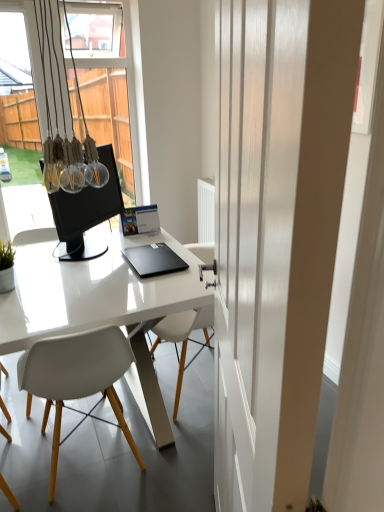
Image resolution: width=384 pixels, height=512 pixels. In order to click on matte black monitor at center in this screenshot , I will do `click(86, 209)`.

The height and width of the screenshot is (512, 384). What do you see at coordinates (92, 292) in the screenshot?
I see `white glossy desk at center` at bounding box center [92, 292].

This screenshot has height=512, width=384. Identify the location of translucent glass light fixture at upper left. (79, 146).

Identify the location of matte black monitor at center. This screenshot has height=512, width=384. click(86, 209).

Considering the positions of objects matte black monitor at center and white glossy door at center in the image provided, who is behind, matte black monitor at center or white glossy door at center?

matte black monitor at center.

Is point (64, 238) positioned in front of point (220, 212)?

No, it is not.

Locate an element on the screen. screen door below the matte black monitor at center (from the image's perspective) is located at coordinates (254, 237).

Is translucent glass light fixture at upper left at the right side of black matte laptop at center?

No.

Between translucent glass light fixture at upper left and black matte laptop at center, which one has smaller size?

black matte laptop at center is smaller.

Identify the location of light fixture behind the black matte laptop at center. This screenshot has width=384, height=512. pos(79,146).

From a real-world perspective, which object rests below the other?

In real-world perspective, black matte laptop at center is lower.

From the picture: Would you say matte black monitor at center is a long distance from white plastic chair at center?

Actually, matte black monitor at center and white plastic chair at center are a little close together.

Measure the distance between matte black monitor at center and white plastic chair at center.

matte black monitor at center and white plastic chair at center are 68.85 centimeters apart from each other.

Is matte black monitor at center oriented towards white plastic chair at center?

No, matte black monitor at center is not facing towards white plastic chair at center.

Is matte black monitor at center to the right of white plastic chair at center from the viewer's perspective?

Incorrect, matte black monitor at center is not on the right side of white plastic chair at center.

Is white plastic chair at center not inside white glossy door at center?

white plastic chair at center is positioned outside white glossy door at center.

Measure the distance from white plastic chair at center to white glossy door at center.

white plastic chair at center and white glossy door at center are 28.21 inches apart from each other.

Is white plastic chair at center oriented away from white glossy door at center?

Yes, white glossy door at center is at the back of white plastic chair at center.

Who is smaller, white plastic chair at center or white glossy door at center?

Smaller between the two is white glossy door at center.

Is translucent glass light fixture at upper left with white glossy desk at center?

No, translucent glass light fixture at upper left is not next to white glossy desk at center.

Does translucent glass light fixture at upper left have a larger size compared to white glossy desk at center?

Actually, translucent glass light fixture at upper left might be smaller than white glossy desk at center.

From the image's perspective, between translucent glass light fixture at upper left and white glossy desk at center, which one is located above?

translucent glass light fixture at upper left, from the image's perspective.

Is point (60, 41) in front of point (116, 321)?

No, (60, 41) is further to viewer.

Is white glossy desk at center facing away from black matte laptop at center?

No, white glossy desk at center's orientation is not away from black matte laptop at center.

Can we say white glossy desk at center lies outside black matte laptop at center?

Yes, white glossy desk at center is outside of black matte laptop at center.

Is white glossy desk at center far away from black matte laptop at center?

No, there isn't a large distance between white glossy desk at center and black matte laptop at center.

Looking at their sizes, would you say white glossy door at center is wider or thinner than black matte laptop at center?

In the image, white glossy door at center appears to be more narrow than black matte laptop at center.

From the picture: Considering the relative positions of white glossy door at center and black matte laptop at center in the image provided, is white glossy door at center to the left of black matte laptop at center from the viewer's perspective?

No.

From the image's perspective, is white glossy door at center positioned above or below black matte laptop at center?

Clearly, from the image's perspective, white glossy door at center is below black matte laptop at center.

How far apart are white glossy door at center and black matte laptop at center?

white glossy door at center is 36.02 inches away from black matte laptop at center.

Where is `screen door that appears in front of the matte black monitor at center`? Image resolution: width=384 pixels, height=512 pixels. screen door that appears in front of the matte black monitor at center is located at coordinates (254, 237).

Where is `laptop that appears on the right of translucent glass light fixture at upper left`? laptop that appears on the right of translucent glass light fixture at upper left is located at coordinates (153, 260).

Considering their positions, is black matte laptop at center positioned closer to white glossy door at center than matte black monitor at center?

The object closer to white glossy door at center is black matte laptop at center.

When comparing their distances from white plastic chair at center, does white glossy door at center or white glossy desk at center seem closer?

white glossy desk at center is closer to white plastic chair at center.

Considering their positions, is white glossy door at center positioned further to translucent glass light fixture at upper left than white plastic chair at center?

The object further to translucent glass light fixture at upper left is white glossy door at center.

Which object lies further to the anchor point white glossy door at center, translucent glass light fixture at upper left or matte black monitor at center?

matte black monitor at center lies further to white glossy door at center than the other object.

From the image, which object appears to be farther from translucent glass light fixture at upper left, white glossy desk at center or white plastic chair at center?

white plastic chair at center.

Based on their spatial positions, is white glossy desk at center or black matte laptop at center closer to white glossy door at center?

The object closer to white glossy door at center is white glossy desk at center.

Considering their positions, is translucent glass light fixture at upper left positioned further to white glossy door at center than white glossy desk at center?

translucent glass light fixture at upper left lies further to white glossy door at center than the other object.

Based on their spatial positions, is white plastic chair at center or matte black monitor at center further from white glossy desk at center?

Based on the image, white plastic chair at center appears to be further to white glossy desk at center.

At what (x,y) coordinates should I click in order to perform the action: click on desk located between white glossy door at center and matte black monitor at center in the depth direction. Please return your answer as a coordinate pair (x, y). This screenshot has height=512, width=384. Looking at the image, I should click on (92, 292).

Image resolution: width=384 pixels, height=512 pixels. Find the location of `laptop between white glossy door at center and translucent glass light fixture at upper left in the front-back direction`. laptop between white glossy door at center and translucent glass light fixture at upper left in the front-back direction is located at coordinates (153, 260).

Identify the location of laptop located between matte black monitor at center and translucent glass light fixture at upper left in the depth direction. (153, 260).

Locate an element on the screen. The image size is (384, 512). television between white glossy desk at center and translucent glass light fixture at upper left in the front-back direction is located at coordinates (86, 209).